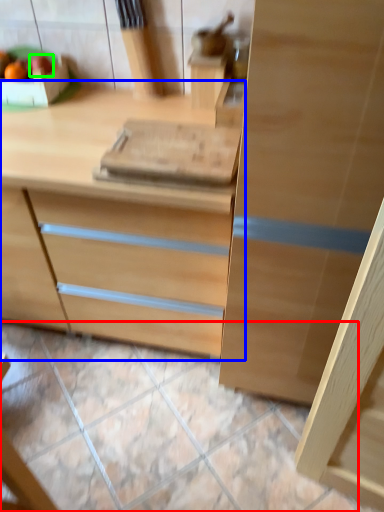
Question: Based on their relative distances, which object is farther from tile (highlighted by a red box)? Choose from chest of drawers (highlighted by a blue box) and fruit (highlighted by a green box).

Choices:
 (A) chest of drawers
 (B) fruit

Answer: (B)